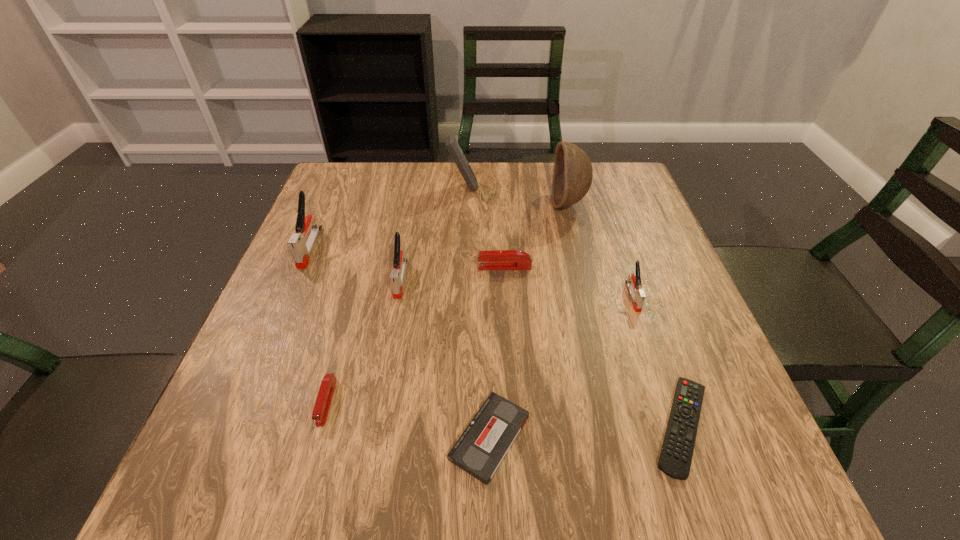
I want to click on free space between the calculator and the seventh object from right to left, so 432,233.

I want to click on vacant area that lies between the sixth shortest object and the fifth tallest object, so click(x=516, y=287).

This screenshot has width=960, height=540. In order to click on vacant region between the third tallest object and the shortest object in this screenshot , I will do `click(496, 336)`.

The height and width of the screenshot is (540, 960). What are the coordinates of `free space between the seventh shortest object and the remote control` in the screenshot? It's located at (496, 336).

This screenshot has width=960, height=540. In order to click on free space that is in between the bowl and the eighth tallest object in this screenshot , I will do [529, 320].

The width and height of the screenshot is (960, 540). In order to click on vacant space in between the remote control and the sixth tallest object in this screenshot , I will do (593, 347).

You are a GUI agent. You are given a task and a screenshot of the screen. Output one action in this format:
    pyautogui.click(x=<x>, y=<y>)
    Task: Click on the vacant point located between the bowl and the shortest object
    The image size is (960, 540).
    Given the screenshot: What is the action you would take?
    pyautogui.click(x=625, y=315)

The height and width of the screenshot is (540, 960). In order to click on vacant area between the bowl and the leftmost gray stapler in this screenshot , I will do 440,225.

Locate an element on the screen. The height and width of the screenshot is (540, 960). empty space that is in between the shortest object and the leftmost stapler is located at coordinates (496, 336).

Locate which object is the sixth closest to the second stapler from left to right. Please provide its 2D coordinates. Your answer should be formatted as a tuple, i.e. [(x, y)], where the tuple contains the x and y coordinates of a point satisfying the conditions above.

[(634, 285)]